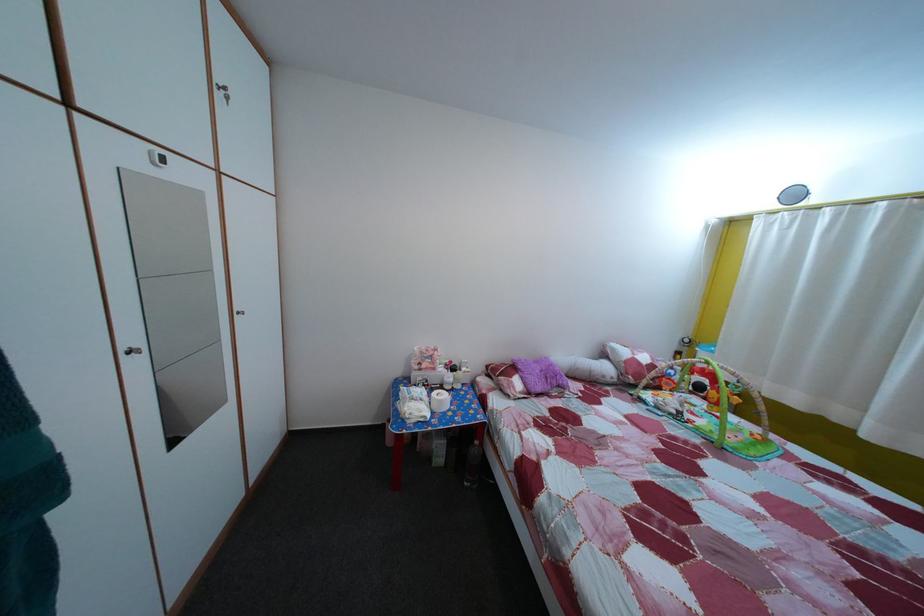
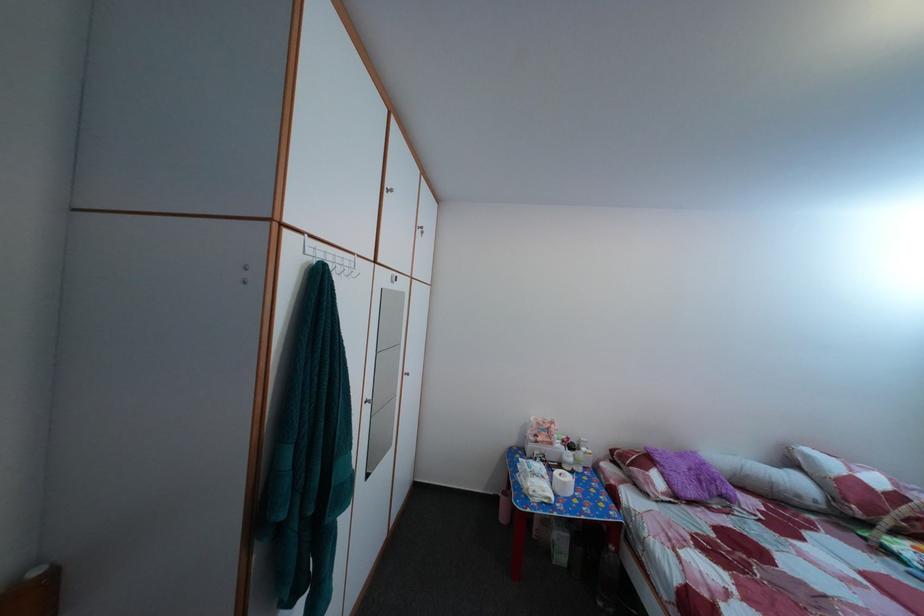
The point at (427, 421) is marked in the first image. Where is the corresponding point in the second image?

(551, 500)